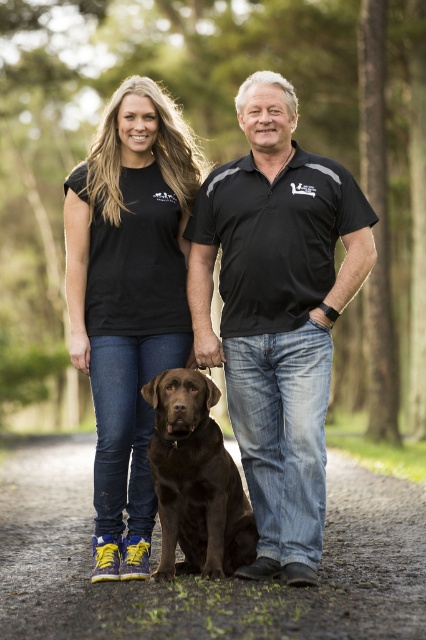
You are standing at the point marked by the coordinates point (278, 314) in the image. Looking around, you see the two people described in the scene. Which direction should you turn to face the man in the black cotton polo shirt?

The point (278, 314) corresponds to the black cotton polo shirt at center, so you are already facing the man in the black cotton polo shirt.

You are trying to determine the distance between two points in the image. The points are labeled as point (138, 467) and point (195, 506). Based on their positions, which point is closer to you?

Point (138, 467) is closer to you because it is further to the viewer than point (195, 506).